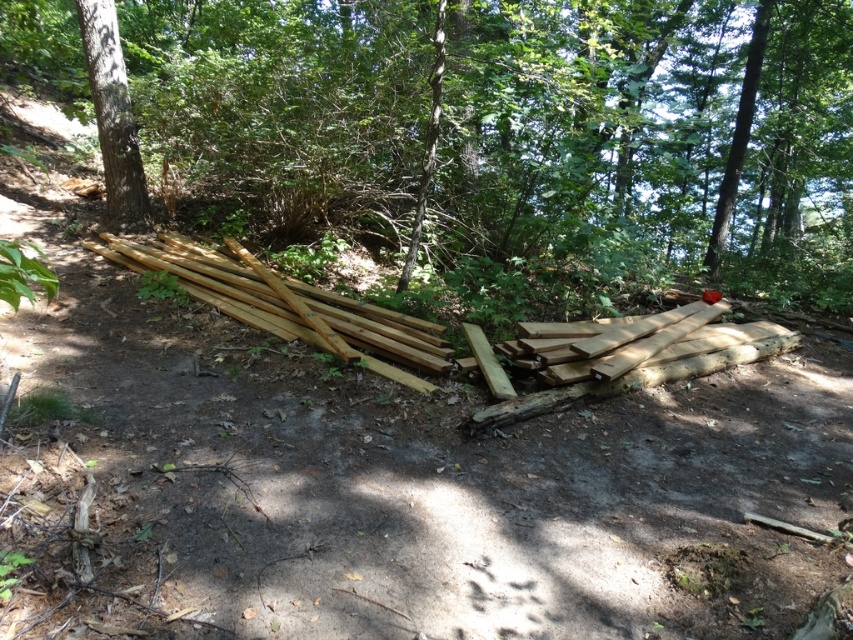
You are a carpenter looking for a specific piece of wood to work with. You need to locate the smooth brown wood at center. Where exactly is it located in the image?

The smooth brown wood at center is located at point coordinates of [520,124] in the image.

You are a hiker trying to find the path through the woods. You see the natural wood at left and the smooth brown tree trunk at upper left. Which object is closer to you?

Answer: The natural wood at left is closer because it is in front of the smooth brown tree trunk at upper left.